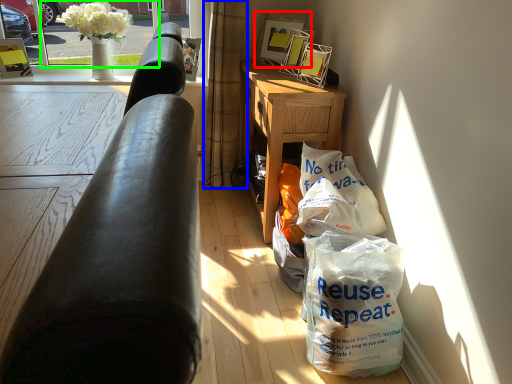
Question: Estimate the real-world distances between objects in this image. Which object is closer to picture frame (highlighted by a red box), curtain (highlighted by a blue box) or window screen (highlighted by a green box)?

Choices:
 (A) curtain
 (B) window screen

Answer: (A)